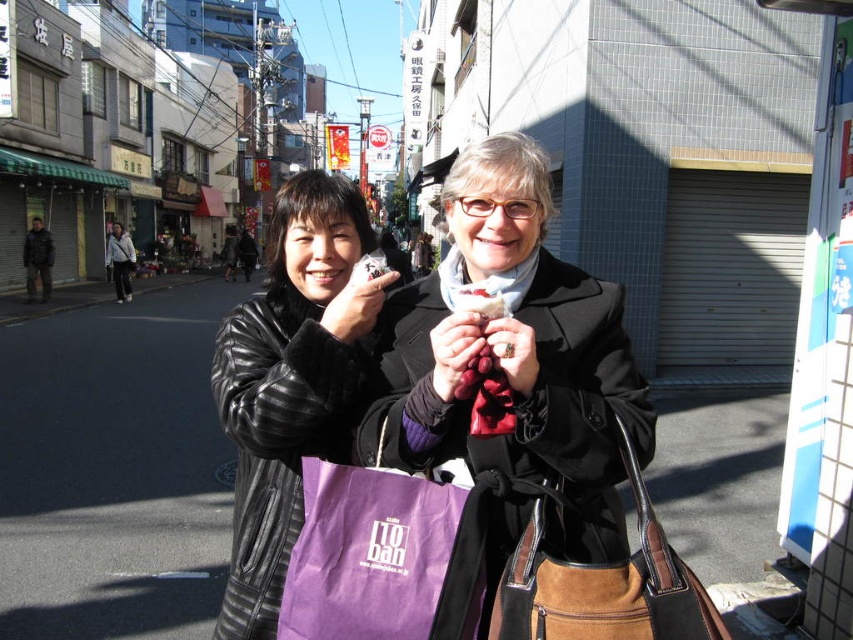
You are standing at the camera position and want to walk towards the point at coordinates point (602, 605). Will you pass by the point at point (434, 451) first?

Since point (434, 451) is behind point (602, 605), you will not pass by point (434, 451) first when walking towards point (602, 605). The point (602, 605) is closer to your starting position at the camera.

You are a photographer trying to capture both the brown suede bag at lower right and the dark brown leather jacket at left in the same frame. Based on their heights, which object should you focus on first to ensure both are in the frame?

The brown suede bag at lower right is shorter than the dark brown leather jacket at left, so you should focus on the dark brown leather jacket at left first to ensure both are in the frame.

In the scene shown: You are a photographer trying to capture both the leather jacket at center and the brown suede bag at lower right in the same frame. Since you want to highlight the jacket, where should you position it relative to the bag?

The leather jacket at center is already positioned on the left side of the brown suede bag at lower right, so to highlight it, you should keep the leather jacket at center on the left side of the brown suede bag at lower right as it is the main focus.